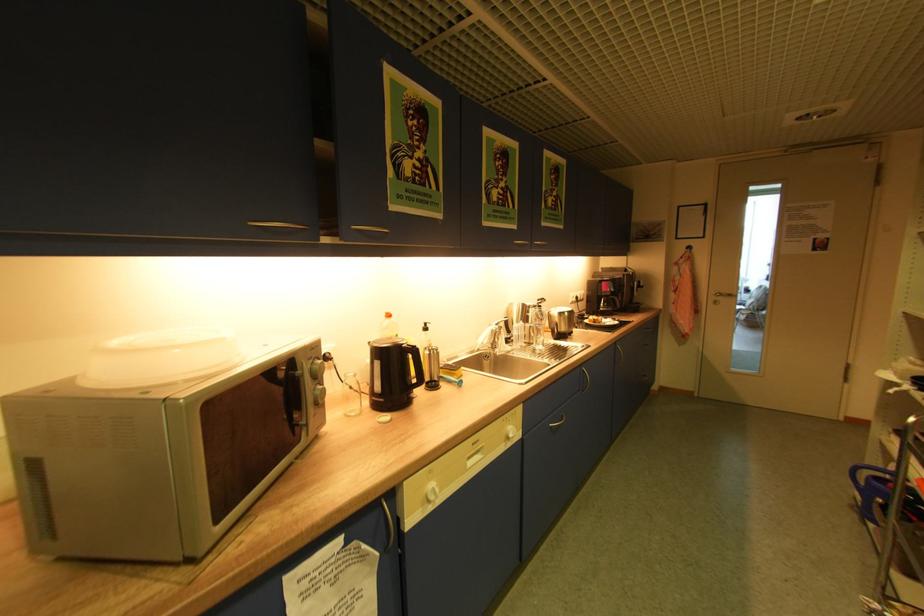
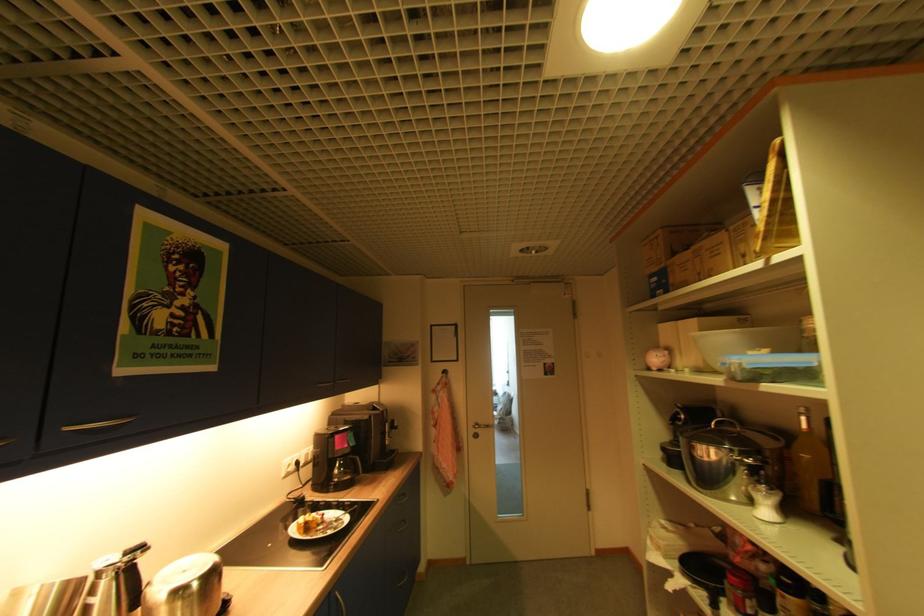
Locate, in the second image, the point that corresponds to point 576,310 in the first image.

(217, 562)